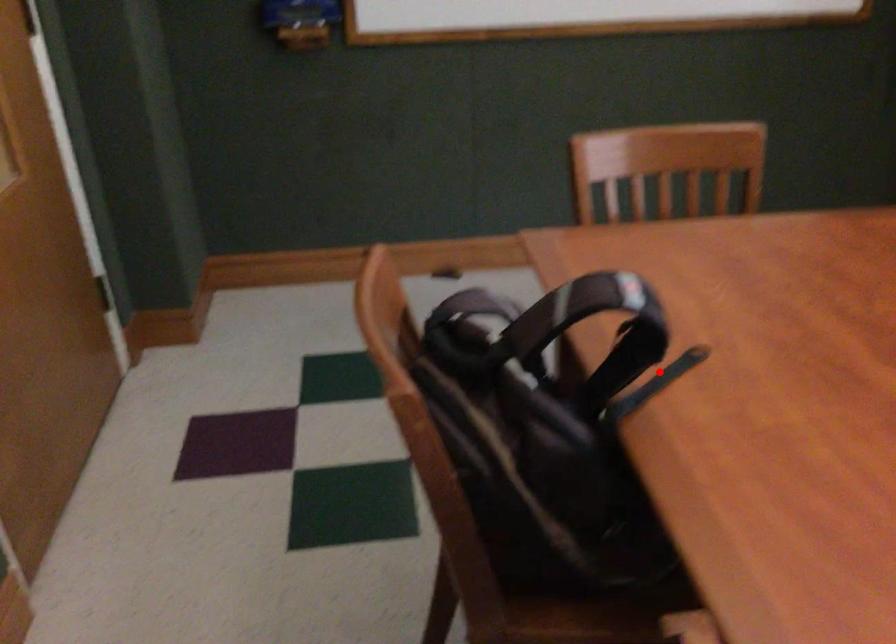
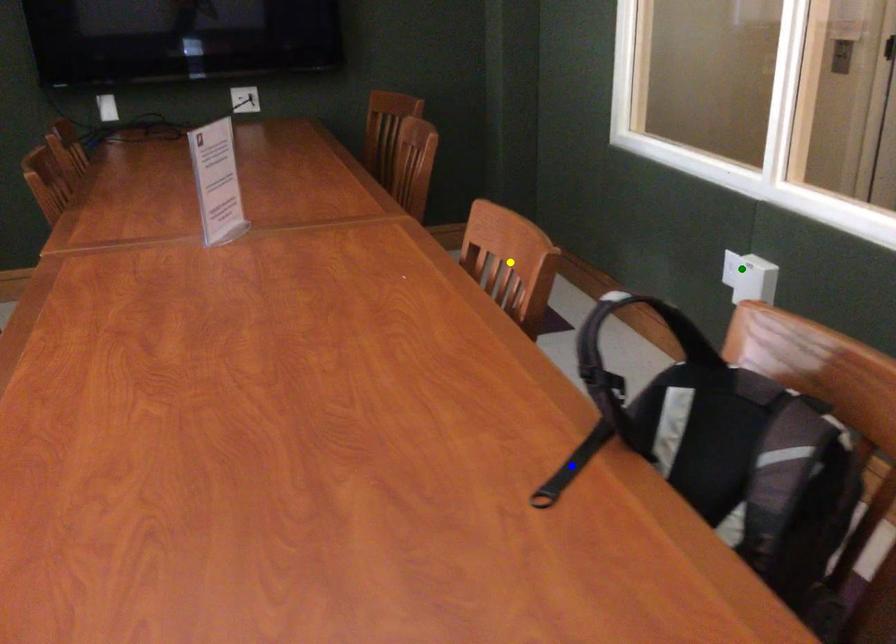
Question: I am providing you with two images of the same scene from different viewpoints. A red point is marked on the first image. You are given multiple points on the second image. Which point in image 2 is actually the same real-world point as the red point in image 1?

Choices:
 (A) blue point
 (B) green point
 (C) yellow point

Answer: (A)